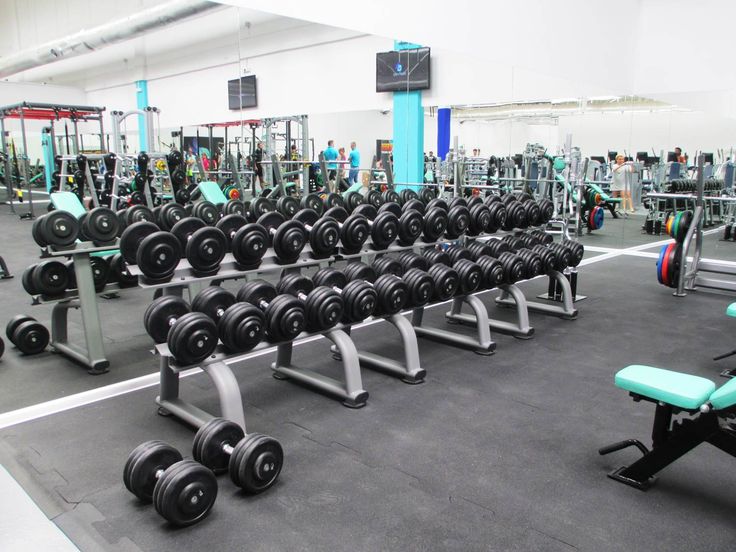
Where is `chair`? This screenshot has width=736, height=552. chair is located at coordinates (665, 402), (726, 312), (216, 195), (68, 198), (353, 187).